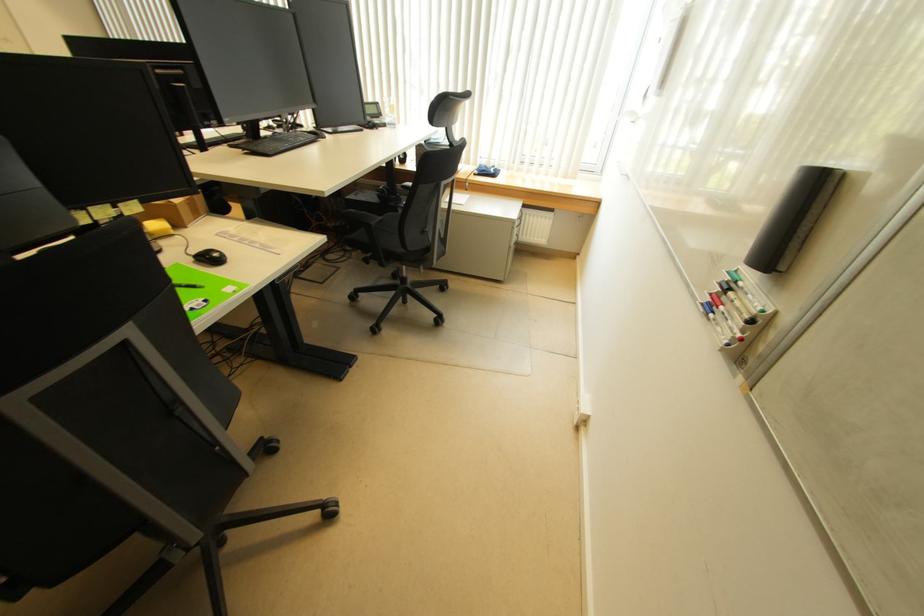
What do you see at coordinates (378, 123) in the screenshot?
I see `a telephone handset` at bounding box center [378, 123].